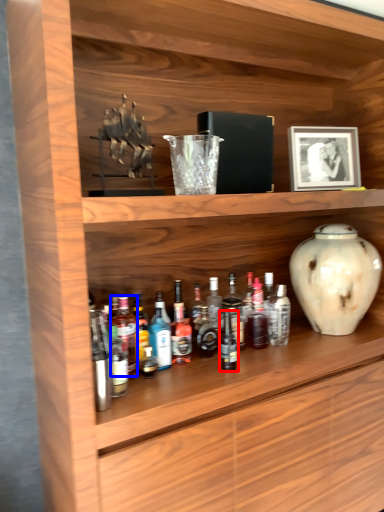
Question: Which object is closer to the camera taking this photo, bottle (highlighted by a red box) or bottle (highlighted by a blue box)?

Choices:
 (A) bottle
 (B) bottle

Answer: (B)